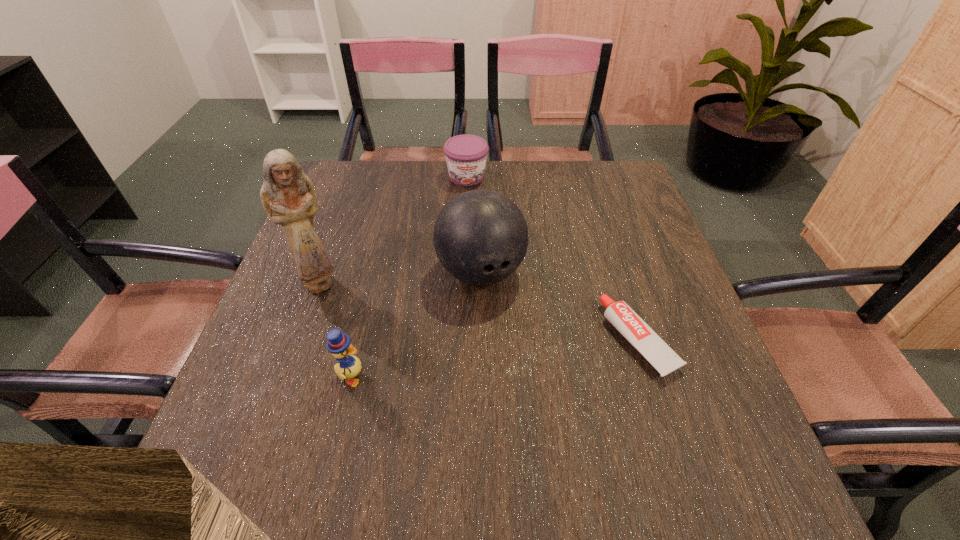
Identify the location of vacant area situated on the left of the toothpaste. (553, 340).

Locate an element on the screen. free space located on the grip area of the bowling ball is located at coordinates (506, 323).

Find the location of a particular element. vacant area situated on the grip area of the bowling ball is located at coordinates (541, 395).

Find the location of a particular element. This screenshot has height=540, width=960. vacant space located on the grip area of the bowling ball is located at coordinates (556, 423).

Locate an element on the screen. vacant space located on the front label of the fourth tallest object is located at coordinates point(474,211).

Find the location of a particular element. This screenshot has height=540, width=960. vacant space situated on the front label of the fourth tallest object is located at coordinates (472, 202).

Where is `vacant space positioned on the front label of the fourth tallest object`? The image size is (960, 540). vacant space positioned on the front label of the fourth tallest object is located at coordinates (487, 272).

Image resolution: width=960 pixels, height=540 pixels. In order to click on vacant space located 0.120m on the front-facing side of the tallest object in this screenshot , I will do `click(381, 309)`.

You are a GUI agent. You are given a task and a screenshot of the screen. Output one action in this format:
    pyautogui.click(x=<x>, y=<y>)
    Task: Click on the free space located 0.150m on the front-facing side of the tallest object
    The height and width of the screenshot is (540, 960).
    Given the screenshot: What is the action you would take?
    pyautogui.click(x=393, y=314)

You are a GUI agent. You are given a task and a screenshot of the screen. Output one action in this format:
    pyautogui.click(x=<x>, y=<y>)
    Task: Click on the vacant space situated 0.190m on the front-facing side of the tallest object
    The height and width of the screenshot is (540, 960).
    Given the screenshot: What is the action you would take?
    pyautogui.click(x=408, y=321)